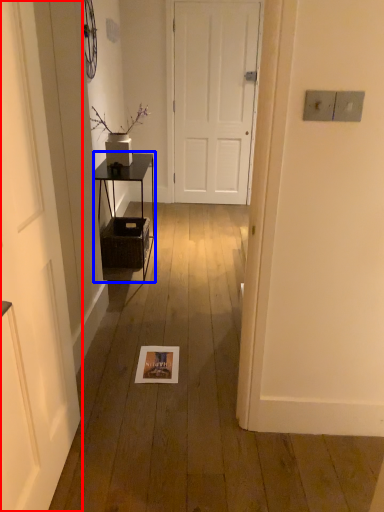
Question: Which object appears closest to the camera in this image, door (highlighted by a red box) or table (highlighted by a blue box)?

Choices:
 (A) door
 (B) table

Answer: (A)